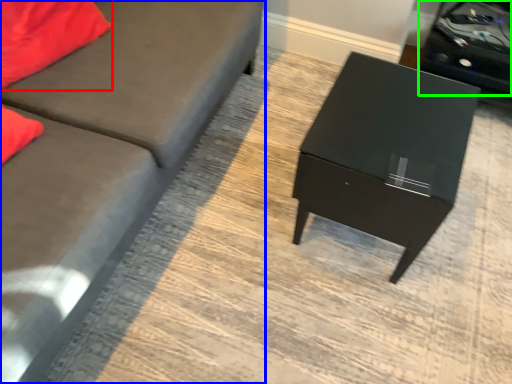
Question: Which object is positioned farthest from pillow (highlighted by a red box)? Select from studio couch (highlighted by a blue box) and side table (highlighted by a green box).

Choices:
 (A) studio couch
 (B) side table

Answer: (B)